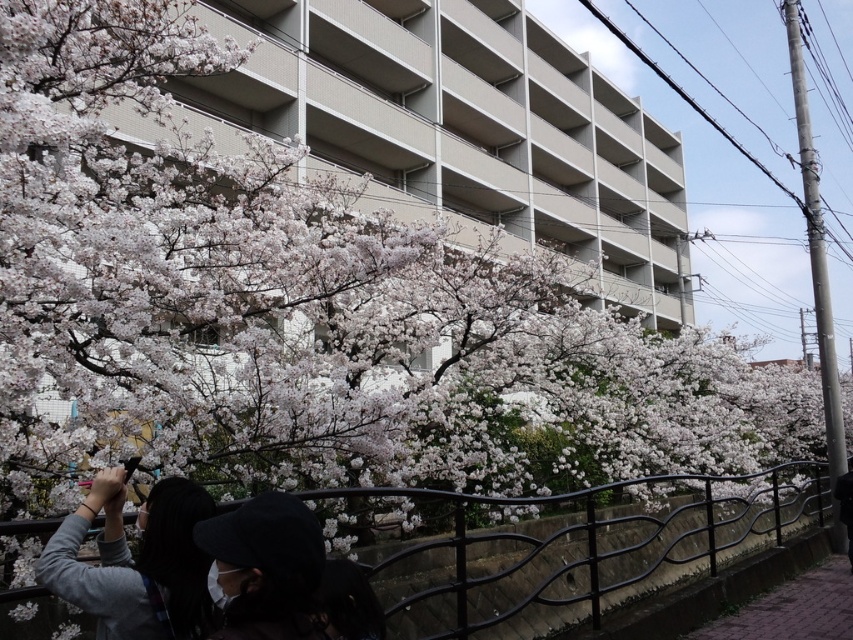
Question: Which object is closer to the camera taking this photo?

Choices:
 (A) black metal fence at lower center
 (B) gray fabric jacket at lower left

Answer: (B)

Question: Does black metal fence at lower center come behind gray fabric jacket at lower left?

Choices:
 (A) yes
 (B) no

Answer: (A)

Question: Is black metal fence at lower center above gray fabric jacket at lower left?

Choices:
 (A) no
 (B) yes

Answer: (A)

Question: Does black metal fence at lower center appear over gray fabric jacket at lower left?

Choices:
 (A) no
 (B) yes

Answer: (A)

Question: Which point is farther to the camera?

Choices:
 (A) (602, 508)
 (B) (178, 600)

Answer: (A)